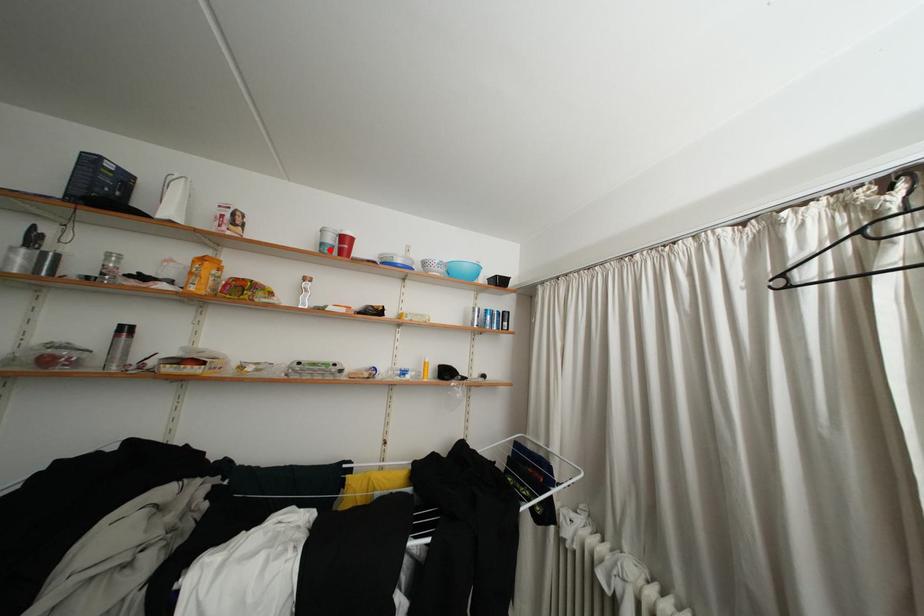
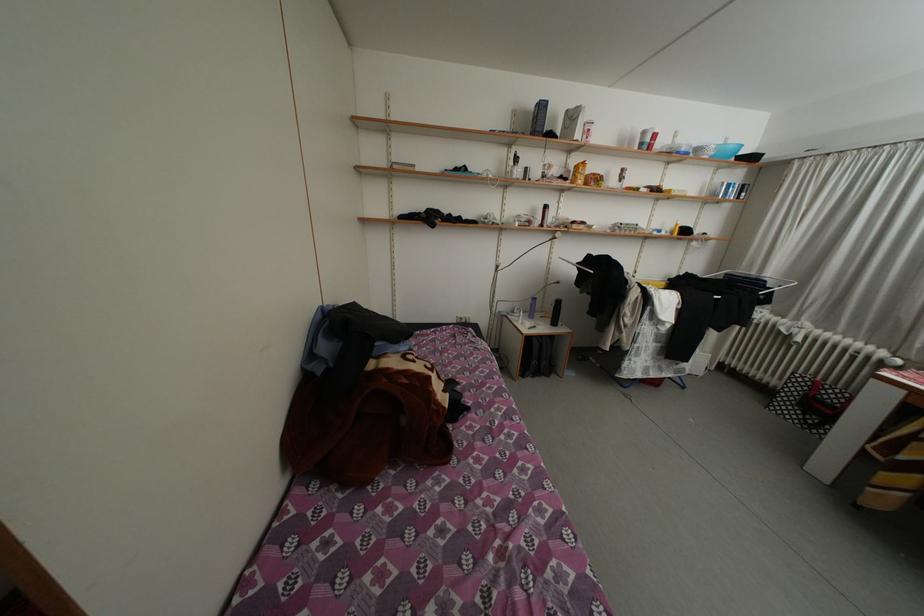
In the second image, find the point that corresponds to the highlighted location in the first image.

(650, 148)